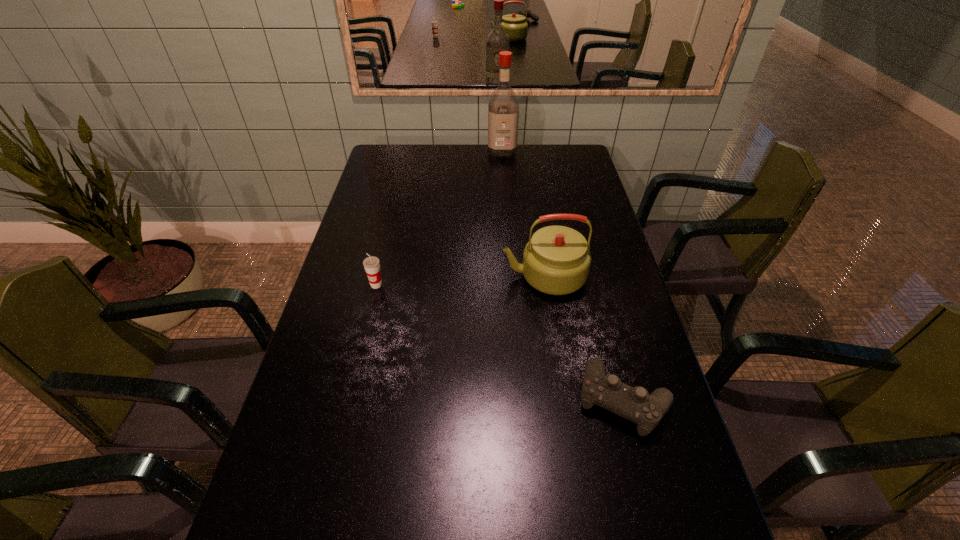
Identify the location of vacant region that satisfies the following two spatial constraints: 1. on the side of the control with the logo; 2. on the left side of the leftmost object. (348, 400).

Find the location of a particular element. The height and width of the screenshot is (540, 960). free space that satisfies the following two spatial constraints: 1. at the spout of the kettle; 2. on the left side of the shortest object is located at coordinates (563, 400).

Find the location of `free spot that satisfies the following two spatial constraints: 1. on the side of the nearest object with the logo; 2. on the right side of the leftmost object`. free spot that satisfies the following two spatial constraints: 1. on the side of the nearest object with the logo; 2. on the right side of the leftmost object is located at coordinates (348, 400).

The width and height of the screenshot is (960, 540). In order to click on vacant area that satisfies the following two spatial constraints: 1. on the back side of the shortest object; 2. at the spout of the third shortest object in this screenshot , I will do `click(591, 276)`.

Where is `vacant area in the image that satisfies the following two spatial constraints: 1. at the spout of the third shortest object; 2. on the left side of the shortest object`? The width and height of the screenshot is (960, 540). vacant area in the image that satisfies the following two spatial constraints: 1. at the spout of the third shortest object; 2. on the left side of the shortest object is located at coordinates (563, 400).

You are a GUI agent. You are given a task and a screenshot of the screen. Output one action in this format:
    pyautogui.click(x=<x>, y=<y>)
    Task: Click on the free space that satisfies the following two spatial constraints: 1. on the side of the leftmost object with the logo; 2. on the left side of the shortest object
    
    Given the screenshot: What is the action you would take?
    pyautogui.click(x=348, y=400)